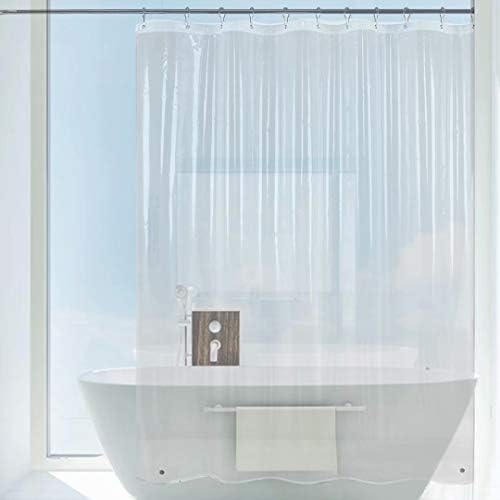
Locate an element on the screen. This screenshot has height=500, width=500. plaque is located at coordinates (215, 335).